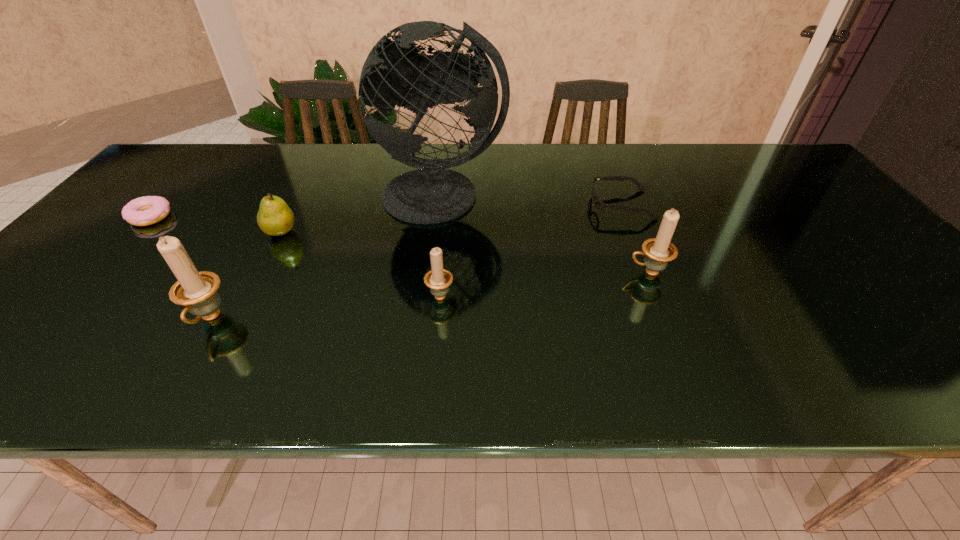
Locate which object is the fifth closest to the shortest candle_holder. Please provide its 2D coordinates. Your answer should be formatted as a tuple, i.e. [(x, y)], where the tuple contains the x and y coordinates of a point satisfying the conditions above.

[(598, 204)]

Locate an element on the screen. The image size is (960, 540). object that is the third closest to the second candle_holder from right to left is located at coordinates (658, 251).

Select which candle_holder is the second closest to the rightmost candle_holder. Please provide its 2D coordinates. Your answer should be formatted as a tuple, i.e. [(x, y)], where the tuple contains the x and y coordinates of a point satisfying the conditions above.

[(197, 291)]

The image size is (960, 540). I want to click on candle_holder that is the closest to the fifth shortest object, so click(438, 279).

Identify the location of vacant space that satisfies the following two spatial constraints: 1. on the front-facing side of the spectacles; 2. on the handle side of the second tallest object. This screenshot has width=960, height=540. (666, 319).